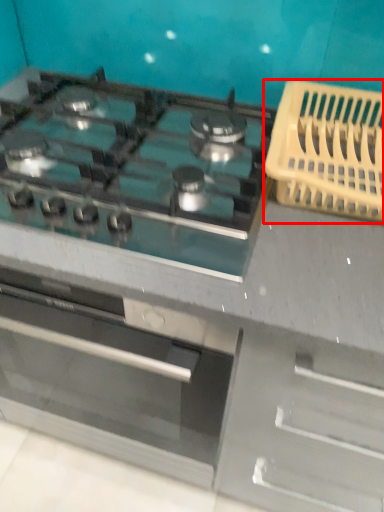
Question: Considering the relative positions of basket (annotated by the red box) and gas stove in the image provided, where is basket (annotated by the red box) located with respect to the staircase?

Choices:
 (A) left
 (B) right

Answer: (B)